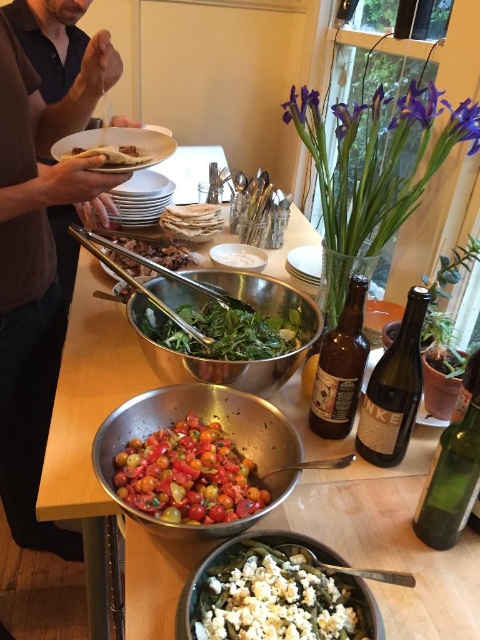
Question: Can you confirm if brown leather shirt at left is positioned to the left of green leafymaterial/texture at lower center?

Choices:
 (A) no
 (B) yes

Answer: (B)

Question: Can you confirm if metallic silver bowl at center is positioned to the right of translucent glass bottle at center right?

Choices:
 (A) no
 (B) yes

Answer: (A)

Question: Is translucent glass bottle at center right above green leafy salad at center?

Choices:
 (A) yes
 (B) no

Answer: (B)

Question: Which point is closer to the camera?

Choices:
 (A) (149, 163)
 (B) (351, 346)

Answer: (B)

Question: Which point is closer to the camera?

Choices:
 (A) brown matte bread at upper left
 (B) green glass bottle at lower right
 (C) translucent glass bottle at center right

Answer: (B)

Question: Estimate the real-world distances between objects in this image. Which object is farther from the brown glass bottle at center?

Choices:
 (A) green glass bottle at lower right
 (B) green leafymaterial/texture at lower center
 (C) shiny red tomatoes at center

Answer: (B)